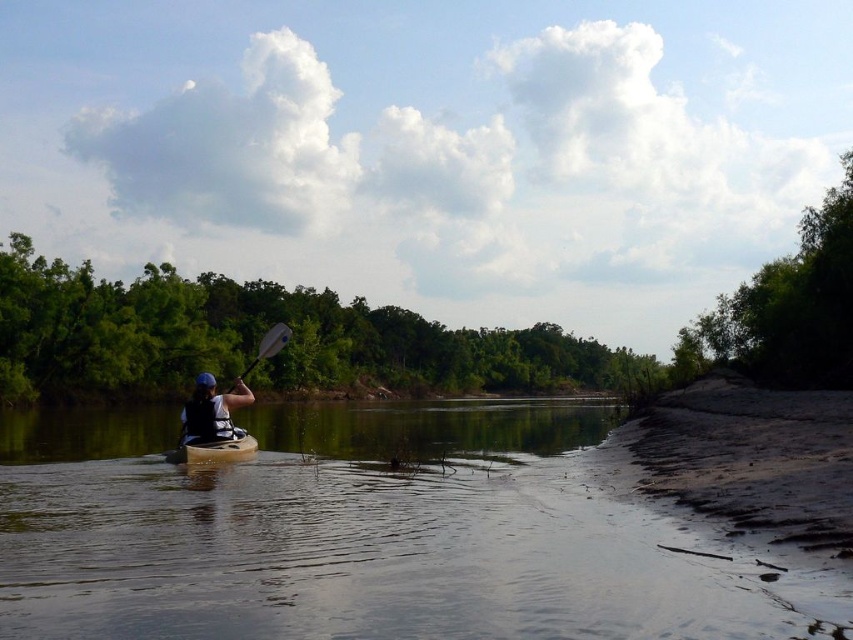
Question: Which point is closer to the camera taking this photo?

Choices:
 (A) (48, 625)
 (B) (241, 442)

Answer: (A)

Question: Is brown matte water at center behind matte black kayak at center?

Choices:
 (A) no
 (B) yes

Answer: (A)

Question: Which of the following is the farthest from the observer?

Choices:
 (A) matte black kayak at center
 (B) smooth brown canoe at center-left

Answer: (A)

Question: In this image, where is matte black kayak at center located relative to smooth brown canoe at center-left?

Choices:
 (A) below
 (B) above

Answer: (B)

Question: Estimate the real-world distances between objects in this image. Which object is closer to the white wood paddle at center?

Choices:
 (A) matte black kayak at center
 (B) smooth brown canoe at center-left
 (C) brown matte water at center

Answer: (A)

Question: Can you confirm if matte black kayak at center is bigger than smooth brown canoe at center-left?

Choices:
 (A) no
 (B) yes

Answer: (A)